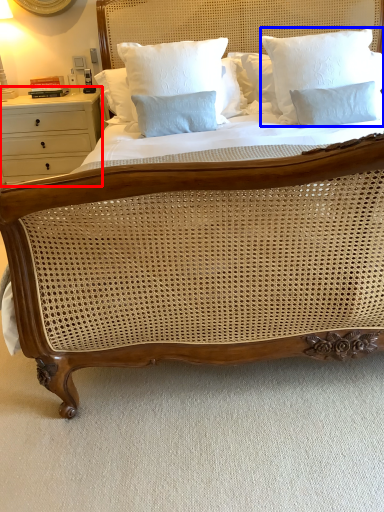
Question: Which point is further to the camera, nightstand (highlighted by a red box) or pillow (highlighted by a blue box)?

Choices:
 (A) nightstand
 (B) pillow

Answer: (A)